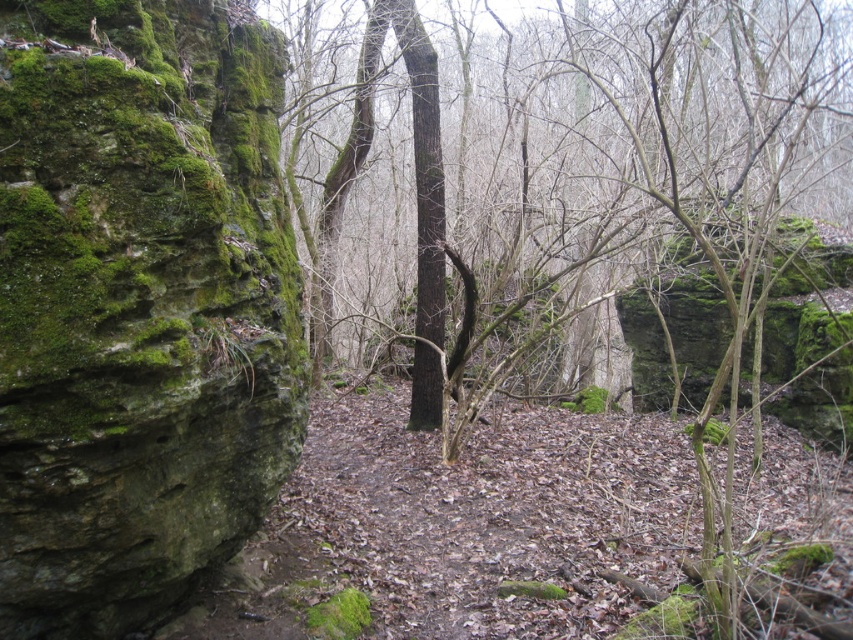
You are a hiker who wants to take a photo of both the green mossy tree at center and the green mossy rock at left. Which object should you focus on first if you want to capture both in one frame without moving the camera?

You should focus on the green mossy tree at center first because it is bigger than the green mossy rock at left, so it will be more prominent in the photo.

You are standing at the point marked as point (527, 385) in the image. What is the nearest object to you in the scene?

The nearest object to you is the green mossy tree at center since the point is located on it.